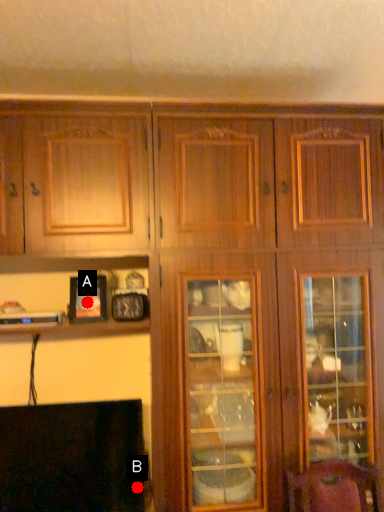
Question: Two points are circled on the image, labeled by A and B beside each circle. Among these points, which one is nearest to the camera?

Choices:
 (A) A is closer
 (B) B is closer

Answer: (B)